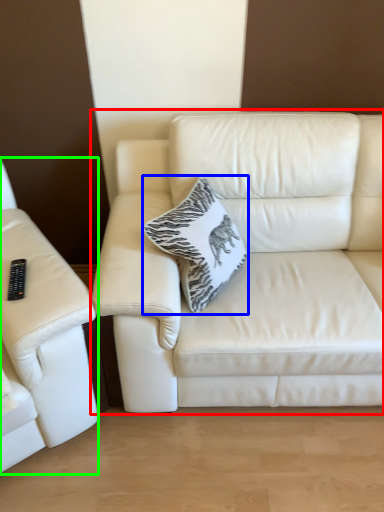
Question: Which object is positioned closest to studio couch (highlighted by a red box)? Select from throw pillow (highlighted by a blue box) and studio couch (highlighted by a green box).

Choices:
 (A) throw pillow
 (B) studio couch

Answer: (A)